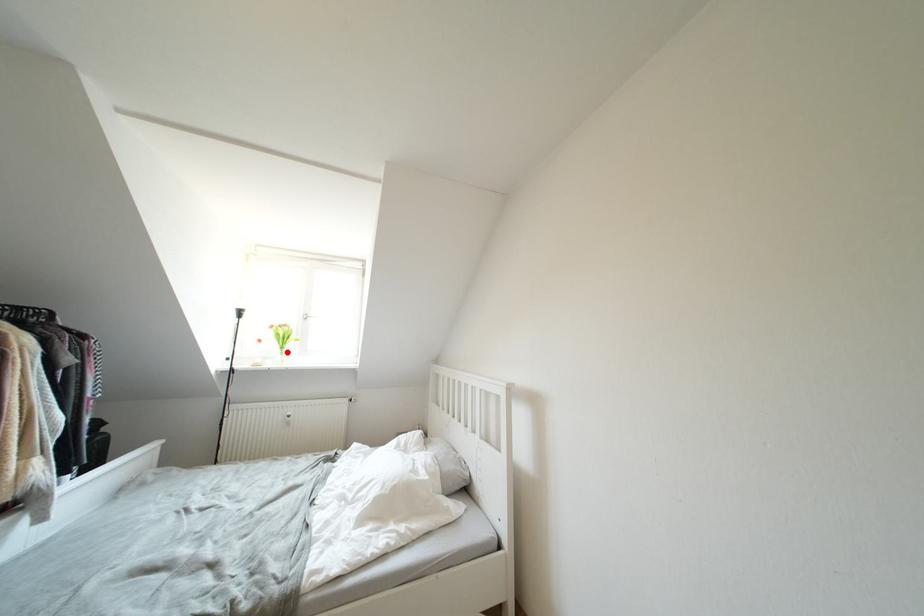
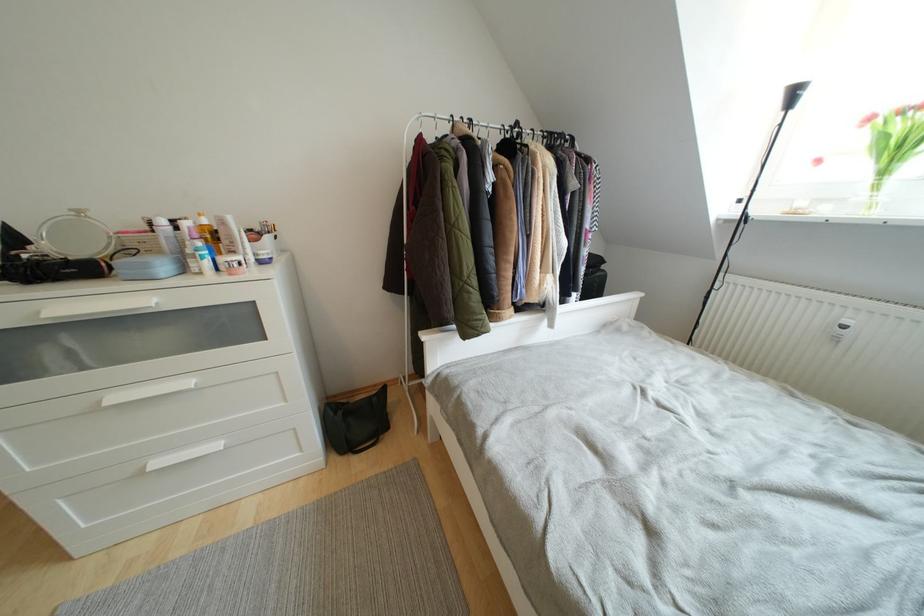
Locate, in the second image, the point that corresponds to the highlighted location in the first image.

(890, 176)